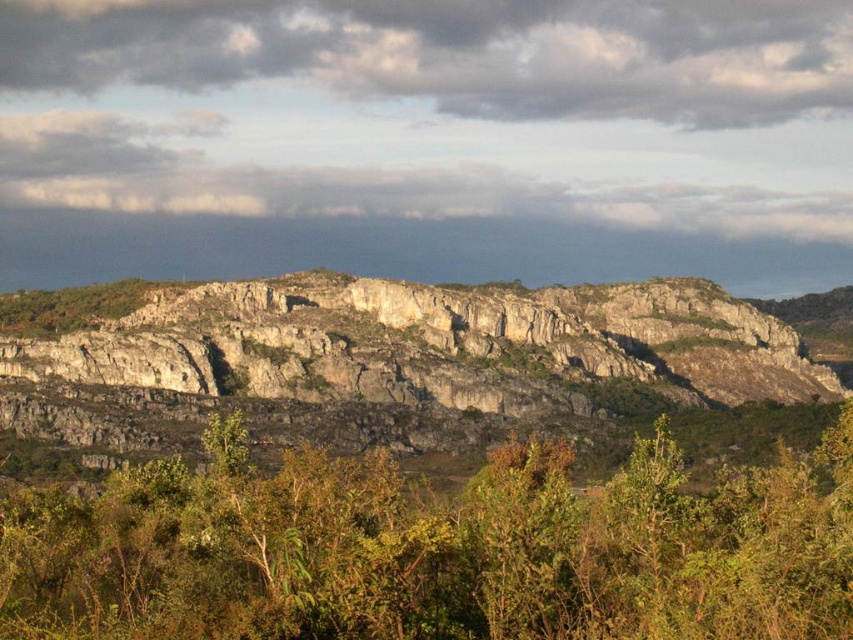
You are a hiker trying to navigate through the rugged landscape. You see the gray rock formation at center and the cloudy sky at upper center. Which object is positioned to the left of the other?

The gray rock formation at center is to the left of cloudy sky at upper center.

You are a hiker who wants to take a photo of the gray rock formation at center and the green leafy shrub at center. Which object should you focus on first if you want to capture both in the same frame without moving your camera? Explain your reasoning based on their positions.

You should focus on the gray rock formation at center first because the green leafy shrub at center is to the right of it. Since they are both at center but the shrub is positioned to the right, adjusting focus to the rock first ensures the shrub remains within the frame when capturing both.

You are a hiker who wants to take a photo of the green leafy shrub at center and the cloudy sky at upper center. Which object should you focus on first if you want to capture both in one shot without moving the camera?

The green leafy shrub at center is to the right of cloudy sky at upper center, so you should focus on the cloudy sky at upper center first as it is closer to the camera, allowing you to adjust the focus to include both objects in the frame.